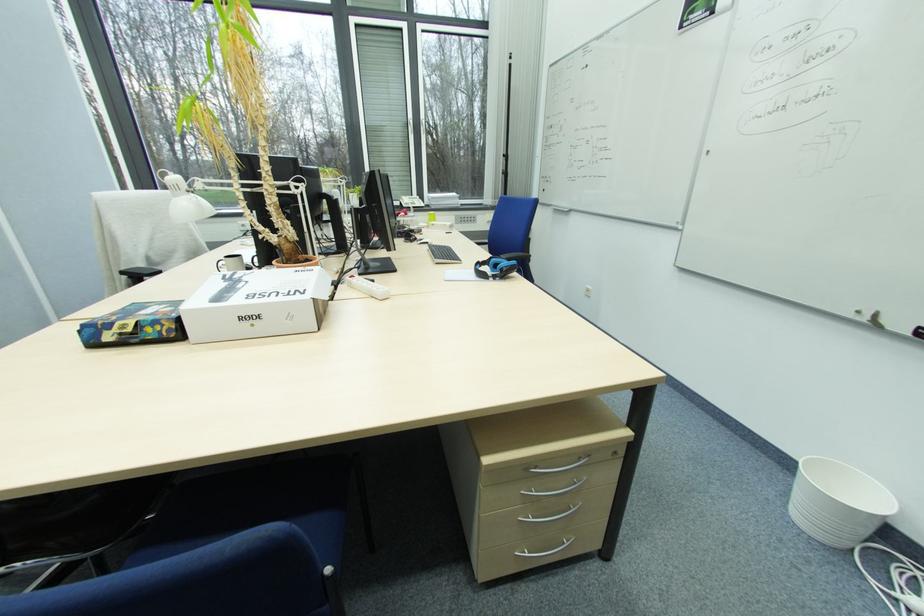
Find where to lift the terracotta plant pot. Please return your answer as a coordinate pair (x, y).

(297, 262)